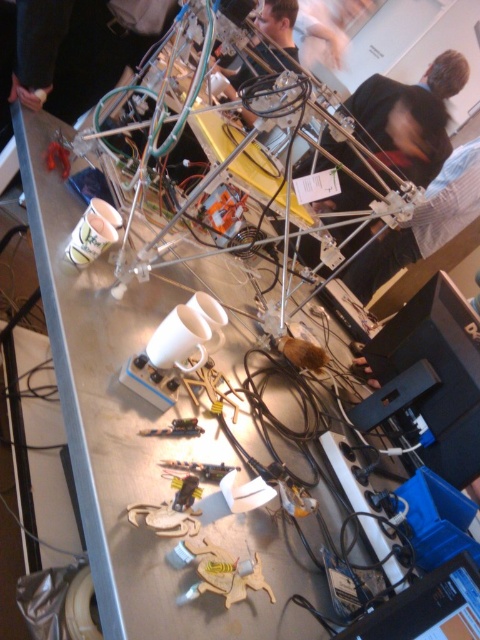
Consider the image. Can you confirm if matte black laptop at upper left is positioned below matte black person at upper center?

Yes.

What are the coordinates of `matte black laptop at upper left` in the screenshot? It's located at (81, 49).

The width and height of the screenshot is (480, 640). What are the coordinates of `matte black laptop at upper left` in the screenshot? It's located at (81, 49).